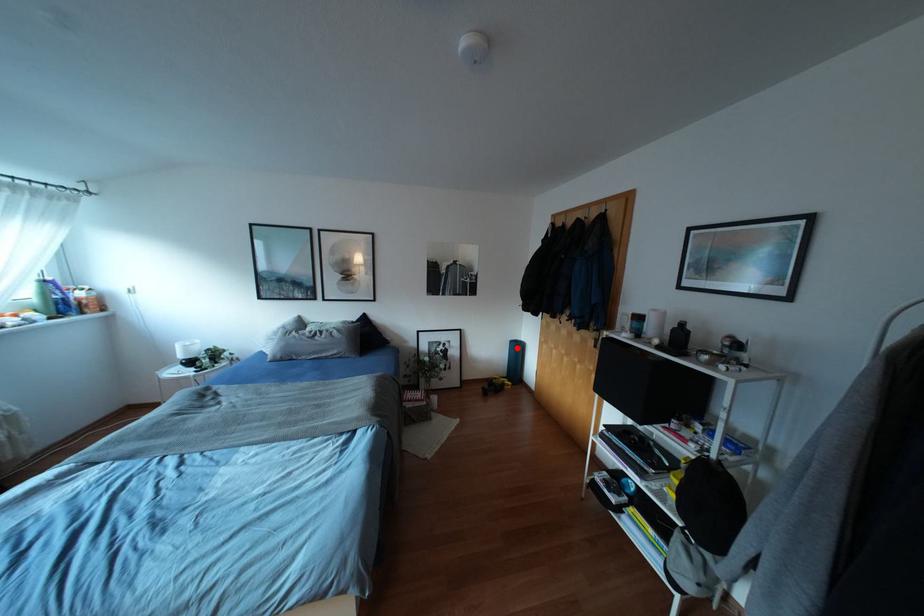
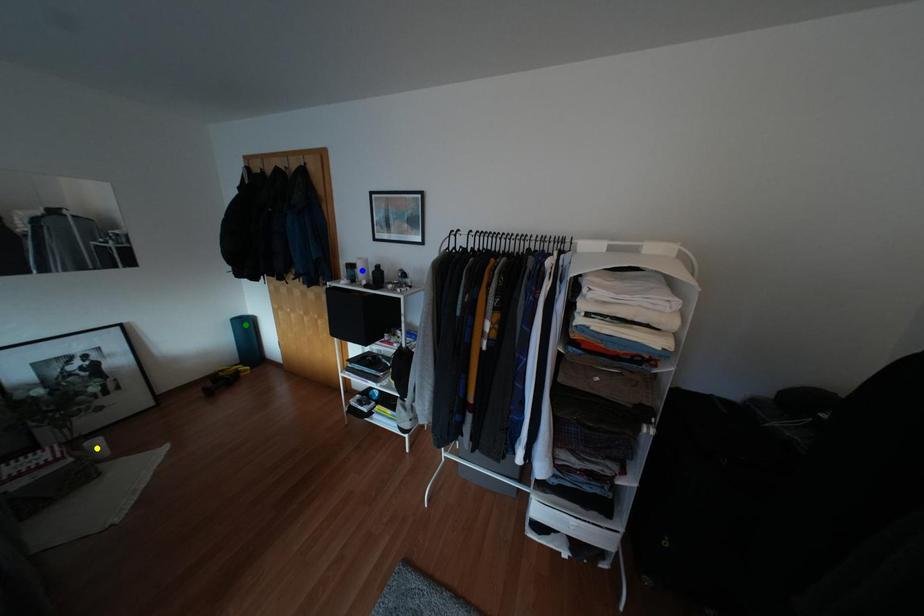
Question: I am providing you with two images of the same scene from different viewpoints. A red point is marked on the first image. You are given multiple points on the second image. Which point in image 2 is actually the same real-world point as the red point in image 1?

Choices:
 (A) green point
 (B) yellow point
 (C) blue point

Answer: (A)